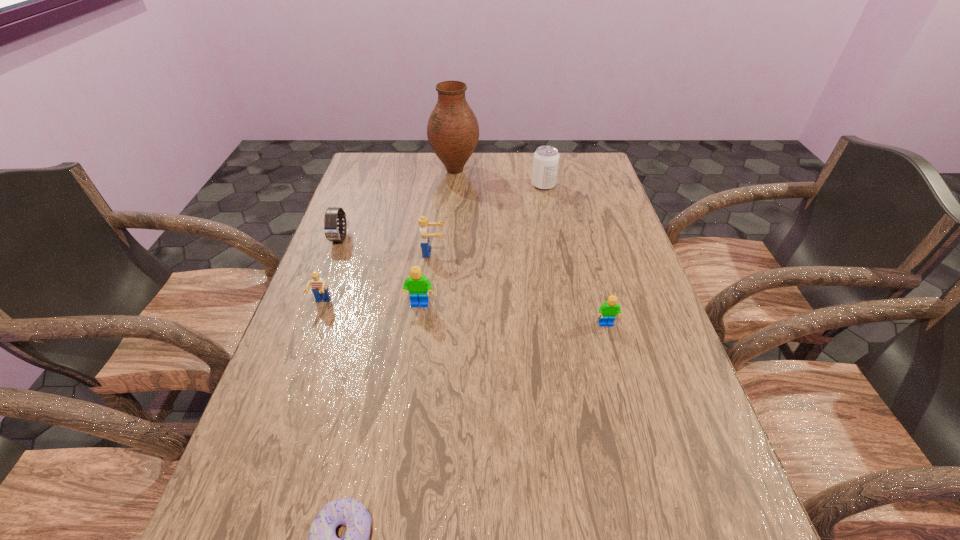
Locate an element on the screen. Image resolution: width=960 pixels, height=540 pixels. free spot between the left green Lego and the nearest Lego is located at coordinates (513, 315).

Locate an element on the screen. This screenshot has width=960, height=540. vacant area that lies between the farther green Lego and the leftmost Lego is located at coordinates (371, 304).

Identify the location of vacant space that is in between the vase and the bigger green Lego. (437, 238).

This screenshot has width=960, height=540. I want to click on the fifth closest object to the watch, so click(x=546, y=158).

At what (x,y) coordinates should I click in order to perform the action: click on the closest object to the bigger green Lego. Please return your answer as a coordinate pair (x, y). The width and height of the screenshot is (960, 540). Looking at the image, I should click on (422, 221).

The width and height of the screenshot is (960, 540). Find the location of `Lego that is the third closest to the tallest object`. Lego that is the third closest to the tallest object is located at coordinates (319, 287).

What are the coordinates of `Lego object that ranks as the second closest to the doughnut` in the screenshot? It's located at (319, 287).

You are a GUI agent. You are given a task and a screenshot of the screen. Output one action in this format:
    pyautogui.click(x=<x>, y=<y>)
    Task: Click on the free location that satisfies the following two spatial constraints: 1. on the face of the right blue Lego; 2. on the face of the smaller blue Lego
    The image size is (960, 540).
    Given the screenshot: What is the action you would take?
    pyautogui.click(x=427, y=303)

At what (x,y) coordinates should I click in order to perform the action: click on vacant space that satisfies the following two spatial constraints: 1. on the front side of the second object from right to left; 2. on the left side of the tallest object. Please return your answer as a coordinate pair (x, y). The width and height of the screenshot is (960, 540). Looking at the image, I should click on (453, 185).

The height and width of the screenshot is (540, 960). I want to click on vacant area in the image that satisfies the following two spatial constraints: 1. on the face of the farther blue Lego; 2. on the face of the farther green Lego, so 426,305.